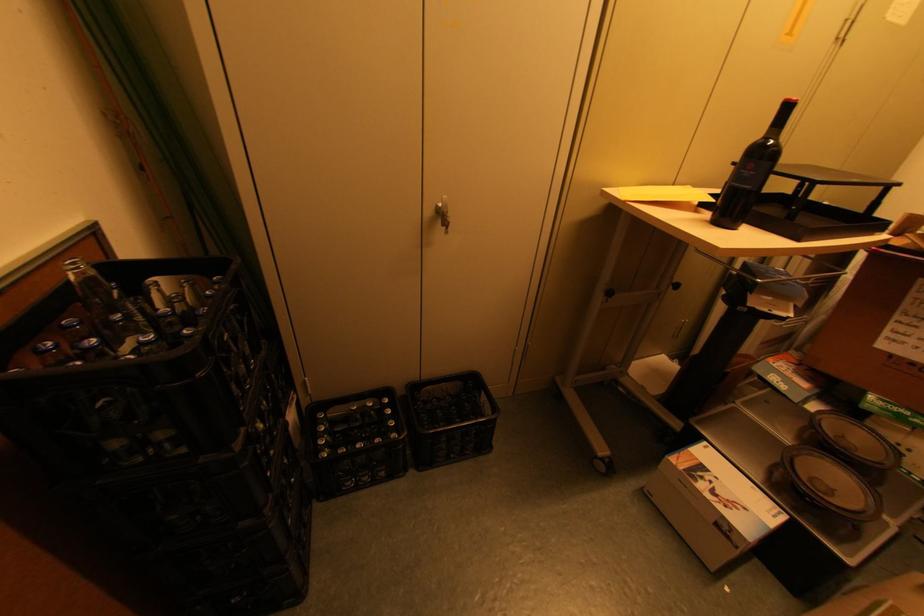
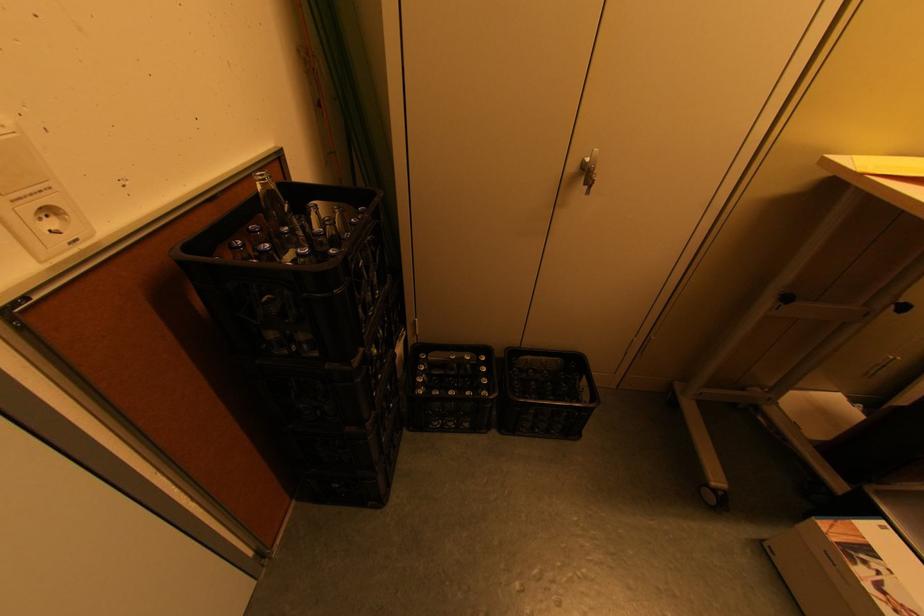
Where in the second image is the point corresponding to (187,282) from the first image?

(338, 208)